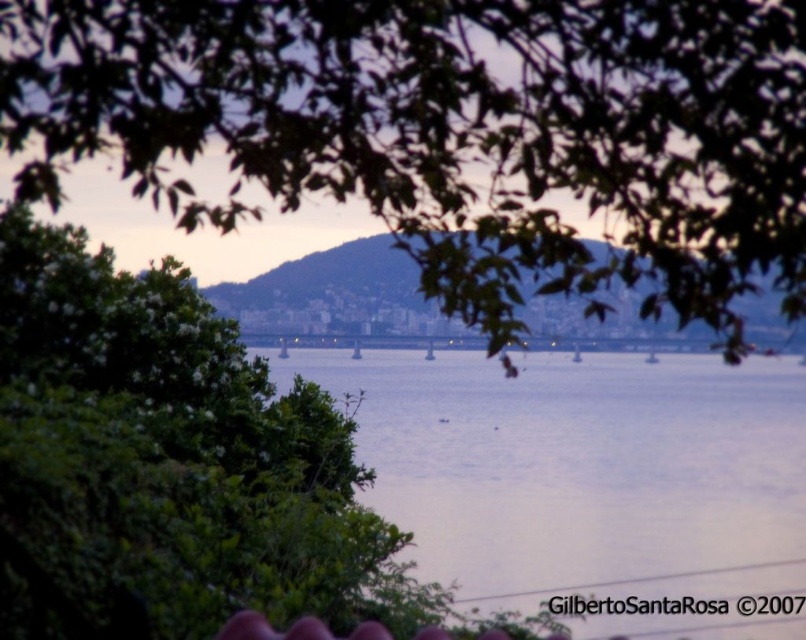
Question: Is white plastic boat at center to the left of smooth white boat at center from the viewer's perspective?

Choices:
 (A) no
 (B) yes

Answer: (B)

Question: Which point is closer to the camera?

Choices:
 (A) (572, 362)
 (B) (534, 269)
 (C) (410, 468)
 (D) (649, 349)

Answer: (B)

Question: Is blue water at center smaller than smooth white boat at center?

Choices:
 (A) yes
 (B) no

Answer: (B)

Question: Considering the relative positions of blue water at center and white plastic boat at center in the image provided, where is blue water at center located with respect to white plastic boat at center?

Choices:
 (A) below
 (B) above

Answer: (A)

Question: Which of these objects is positioned farthest from the green leafy tree at upper center?

Choices:
 (A) white plastic boat at center
 (B) blue water at center

Answer: (A)

Question: Which point is closer to the camera taking this photo?

Choices:
 (A) (580, 358)
 (B) (655, 358)
 (C) (462, 268)

Answer: (C)